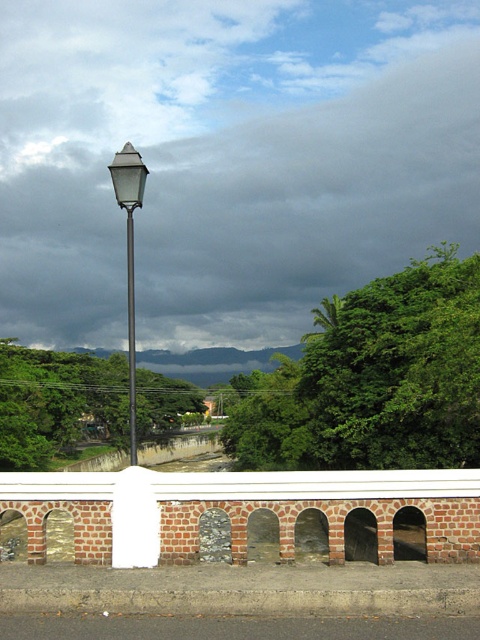
You are standing in front of the brick wall with arched openings and want to walk to the green leafy tree at upper center. However, there is another green leafy tree at center blocking your path. Can you walk around it to reach your destination?

The green leafy tree at upper center and green leafy tree at center are 46.17 feet apart. Since the distance between them is significant, you can walk around the green leafy tree at center to reach the green leafy tree at upper center.

You are standing in front of the brick wall with arched openings and looking towards the cloudy sky. Which object, the green leafy tree at upper center or the metallic streetlight at center, is positioned to the right of the other?

The green leafy tree at upper center is positioned to the right of the metallic streetlight at center.